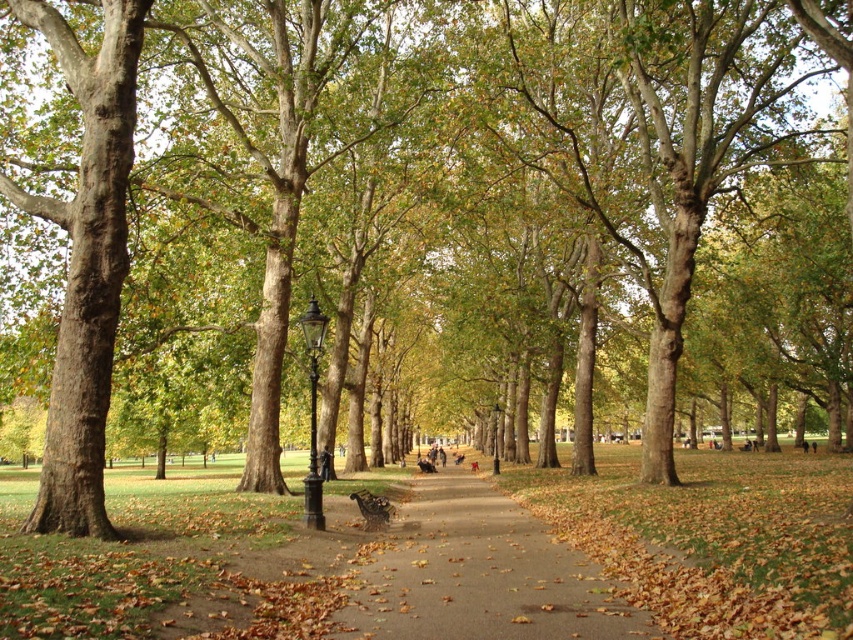
Question: Among these points, which one is nearest to the camera?

Choices:
 (A) (364, 512)
 (B) (523, 618)

Answer: (B)

Question: Does brown/rough pavement at center have a smaller size compared to wooden park bench at center?

Choices:
 (A) yes
 (B) no

Answer: (B)

Question: Which point is farther to the camera?

Choices:
 (A) (527, 568)
 (B) (358, 497)

Answer: (B)

Question: Is brown/rough pavement at center in front of wooden park bench at center?

Choices:
 (A) no
 (B) yes

Answer: (B)

Question: Does brown/rough pavement at center appear over wooden park bench at center?

Choices:
 (A) yes
 (B) no

Answer: (B)